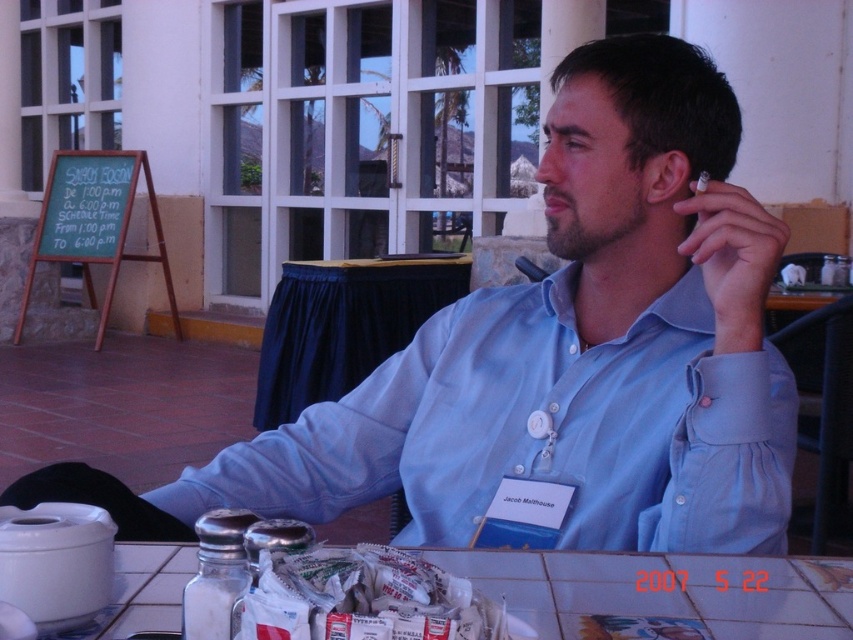
Please provide the coordinates of the white tile table at lower center in the image. The coordinates should be given as a point in the format of two decimal numbers separated by a comma, like 0.5,0.5.

The coordinates of the white tile table at lower center are (664, 592).

You are standing in the outdoor dining area and want to reach the point at coordinates (732,595). If your arm can extend 30 inches, can you reach it?

The point at coordinates (732,595) is 30.82 inches away from the camera, so your arm can only extend 30 inches, meaning you cannot reach it.